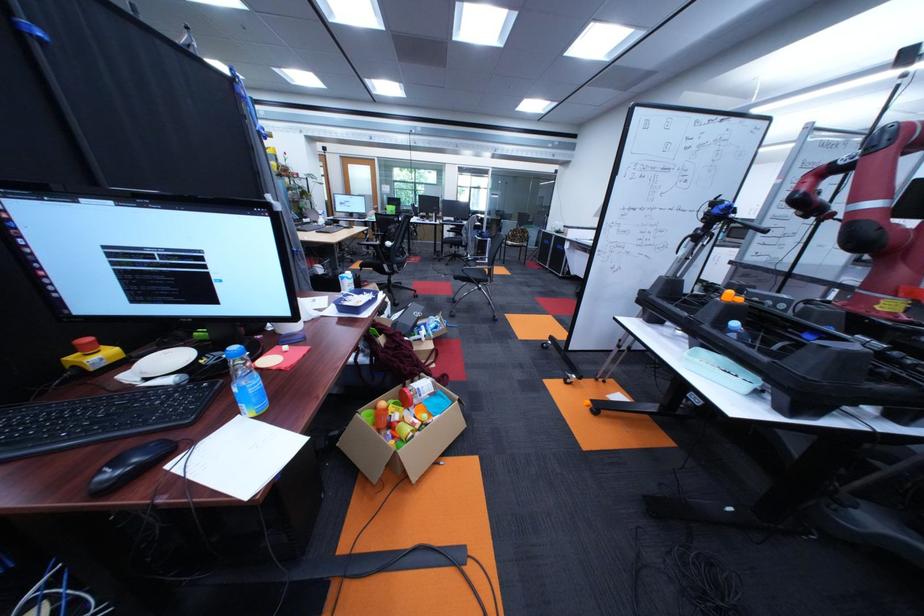
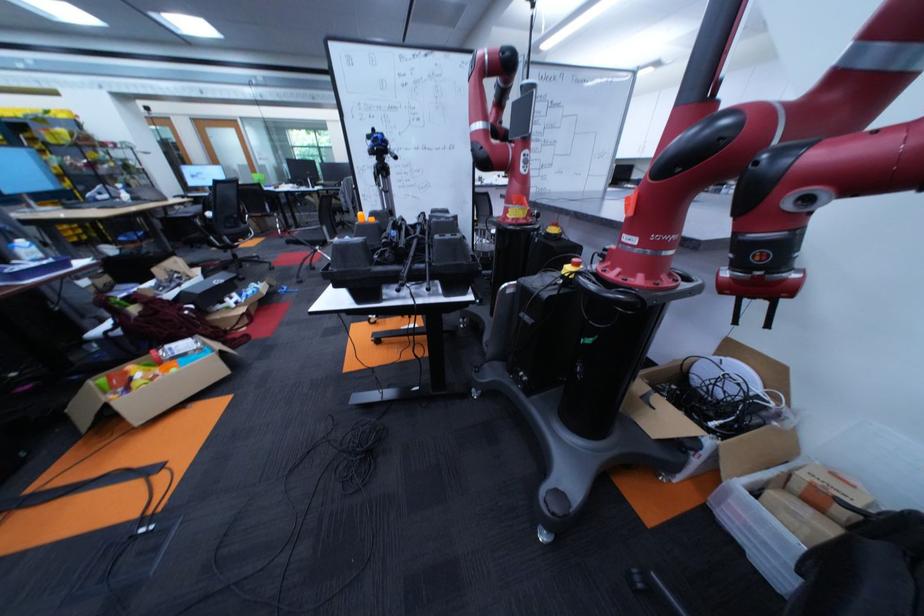
The point at [444,330] is marked in the first image. Where is the corresponding point in the second image?

(258, 296)